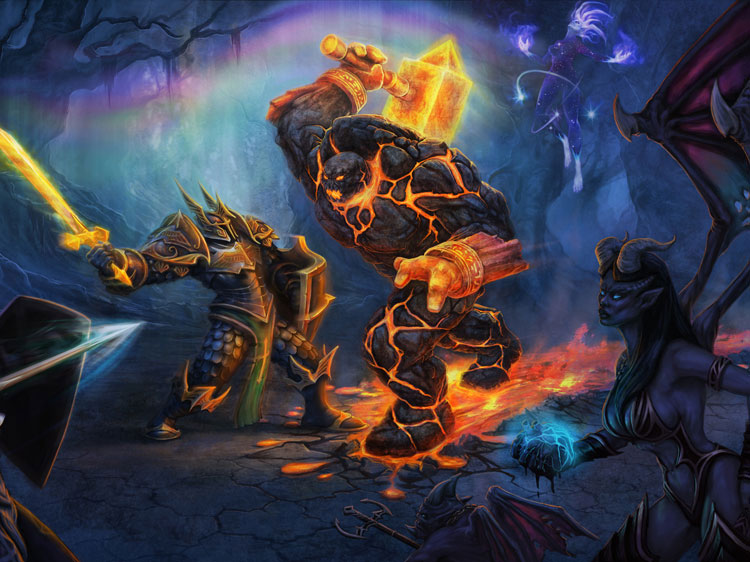
Where is `cracked floor`? The width and height of the screenshot is (750, 562). cracked floor is located at coordinates (232, 523).